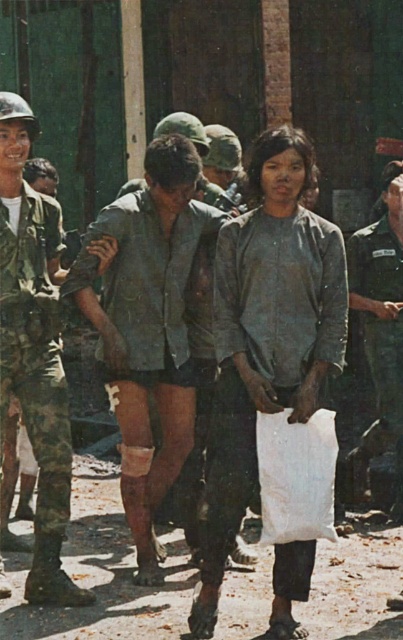
You are a soldier in the military unit. You need to reach a specific point marked at coordinates point (226,385). Given that you can move 3 feet per second, how many seconds will it take you to reach that point?

The distance of point (226,385) from viewer is 16.54 feet. At a speed of 3 feet per second, it will take 16.54 divided by 3, which is approximately 5.51 seconds to reach the point.

You are a drone operator trying to capture coordinates in a military zone. You have two points to mark on your screen. Which of the two points, point (87,252) or point (392,205), is closer to your camera view?

Point (87,252) is closer to the camera than point (392,205).

In the scene described, there are two individuals wearing camouflage fabric shirt at center and camouflage uniform at center. Which one is positioned lower in the image?

The camouflage fabric shirt at center is located below the camouflage uniform at center, so it is positioned lower in the image.